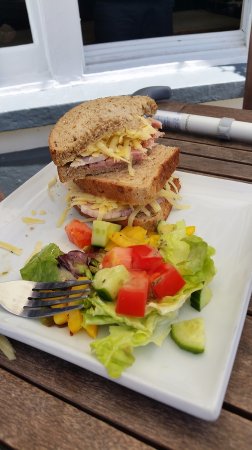
This screenshot has height=450, width=252. I want to click on window sill, so click(x=119, y=76).